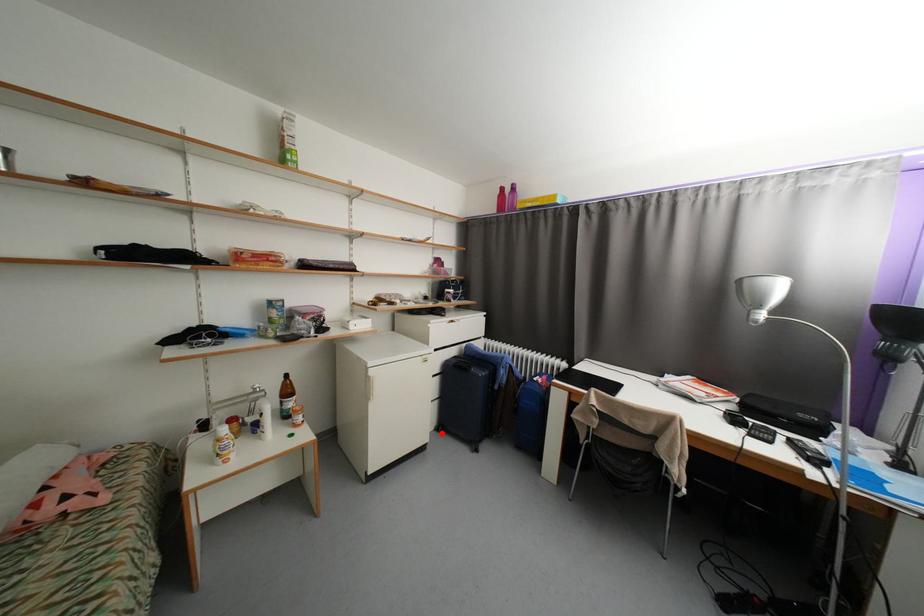
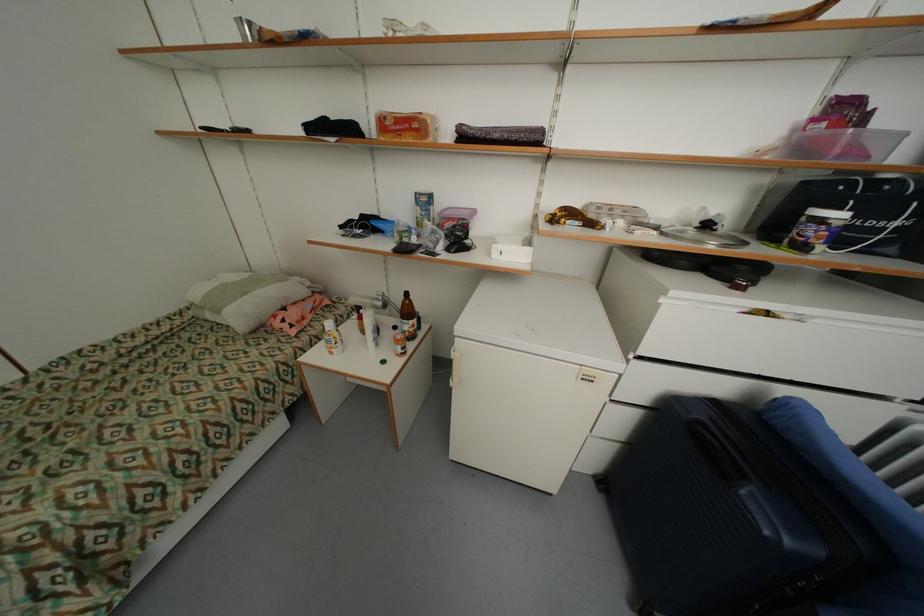
In the second image, find the point that corresponds to the highlighted location in the first image.

(599, 483)